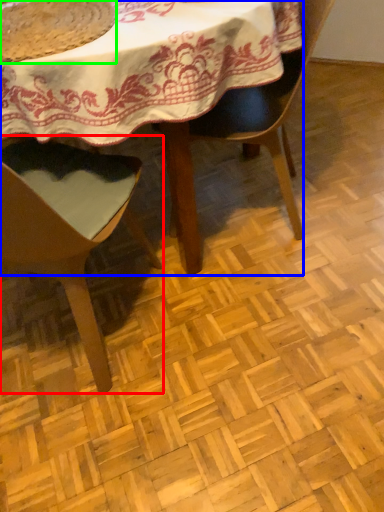
Question: Based on their relative distances, which object is farther from chair (highlighted by a red box)? Choose from table (highlighted by a blue box) and food (highlighted by a green box).

Choices:
 (A) table
 (B) food

Answer: (B)